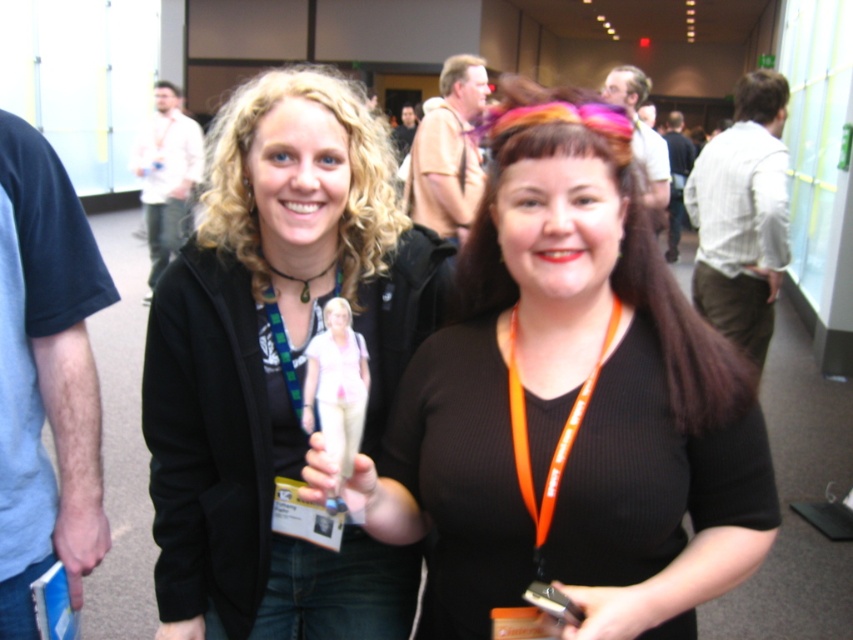
You are organizing a photo shoot and need to ensure that the black matte shirt at center and the green fabric lanyard at center are both visible in the frame. Given their sizes, which object should you focus on to ensure both are in the shot?

The black matte shirt at center has a larger size compared to the green fabric lanyard at center, so focusing on the larger black matte shirt at center will ensure both objects are visible in the frame.

Consider the image. You are standing in the middle of the room and see the point marked at coordinates [572,403]. What object is located at that point?

The point at coordinates [572,403] indicates the location of the black matte shirt at center.